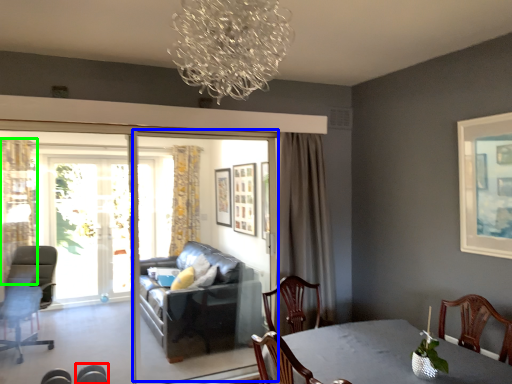
Question: Which object is the farthest from chair (highlighted by a red box)? Choose among these: screen door (highlighted by a blue box) or curtain (highlighted by a green box).

Choices:
 (A) screen door
 (B) curtain

Answer: (B)